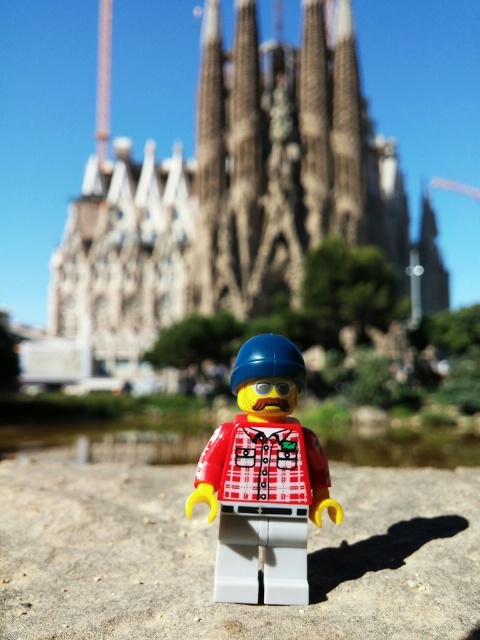
Based on the photo, which is below, gray stone sand at center or plaid fabric minifigure at center?

Positioned lower is gray stone sand at center.

Who is more distant from viewer, (376,516) or (290,497)?

The point (376,516) is more distant.

Where is `gray stone sand at center`? The image size is (480, 640). gray stone sand at center is located at coordinates (214, 557).